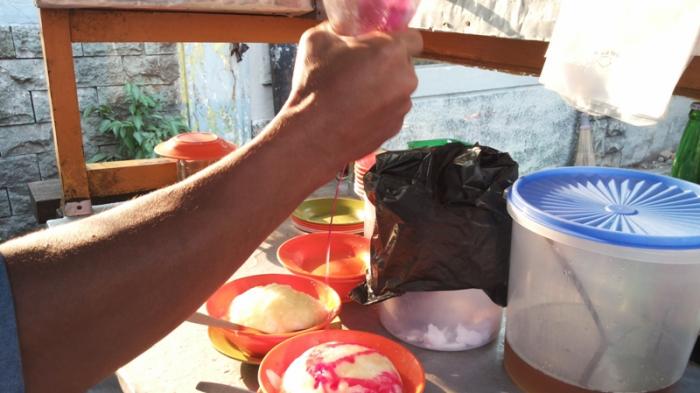
Find the location of a particular element. This screenshot has width=700, height=393. orange bowls is located at coordinates point(321,263), point(297,283), point(346,329).